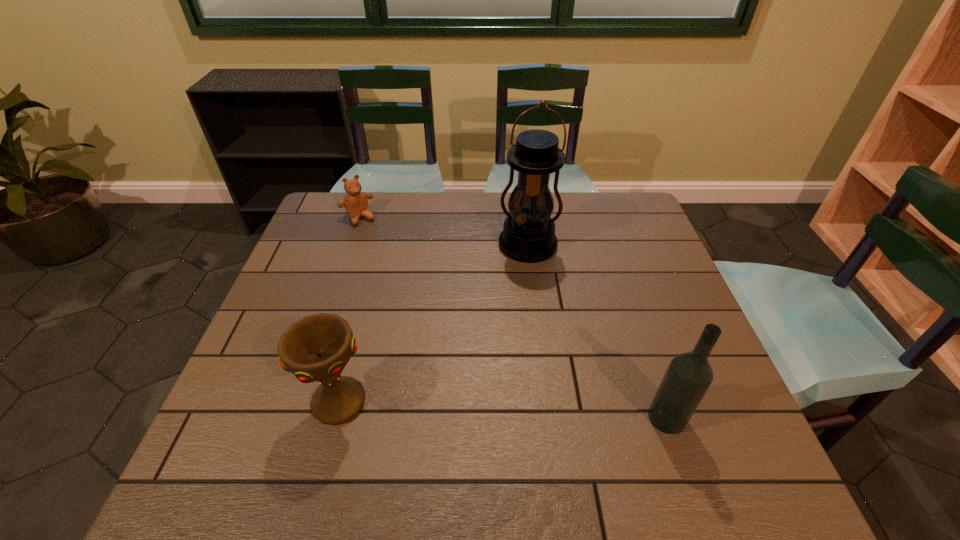
Find the location of a particular element. the third tallest object is located at coordinates (315, 348).

This screenshot has height=540, width=960. I want to click on the third shortest object, so click(689, 375).

You are a GUI agent. You are given a task and a screenshot of the screen. Output one action in this format:
    pyautogui.click(x=<x>, y=<y>)
    Task: Click on the rightmost object
    Image resolution: width=960 pixels, height=540 pixels.
    Given the screenshot: What is the action you would take?
    click(x=689, y=375)

You are a GUI agent. You are given a task and a screenshot of the screen. Output one action in this format:
    pyautogui.click(x=<x>, y=<y>)
    Task: Click on the lantern
    
    Given the screenshot: What is the action you would take?
    pyautogui.click(x=528, y=235)

This screenshot has width=960, height=540. What are the coordinates of `the tallest object` in the screenshot? It's located at (528, 235).

Locate an element on the screen. Image resolution: width=960 pixels, height=540 pixels. the shortest object is located at coordinates (355, 202).

Find the location of a particular element. The width and height of the screenshot is (960, 540). free space located 0.080m on the right of the chalice is located at coordinates (410, 402).

Locate an element on the screen. The width and height of the screenshot is (960, 540). blank area located on the left of the second tallest object is located at coordinates (599, 418).

Locate the blank area located 0.120m above the lantern, indicating its light source in the image. Please provide its 2D coordinates. Your answer should be formatted as a tuple, i.e. [(x, y)], where the tuple contains the x and y coordinates of a point satisfying the conditions above.

[(516, 296)]

Locate several spots within vacant area situated 0.060m above the lantern, indicating its light source. Please provide its 2D coordinates. Your answer should be formatted as a tuple, i.e. [(x, y)], where the tuple contains the x and y coordinates of a point satisfying the conditions above.

[(519, 281)]